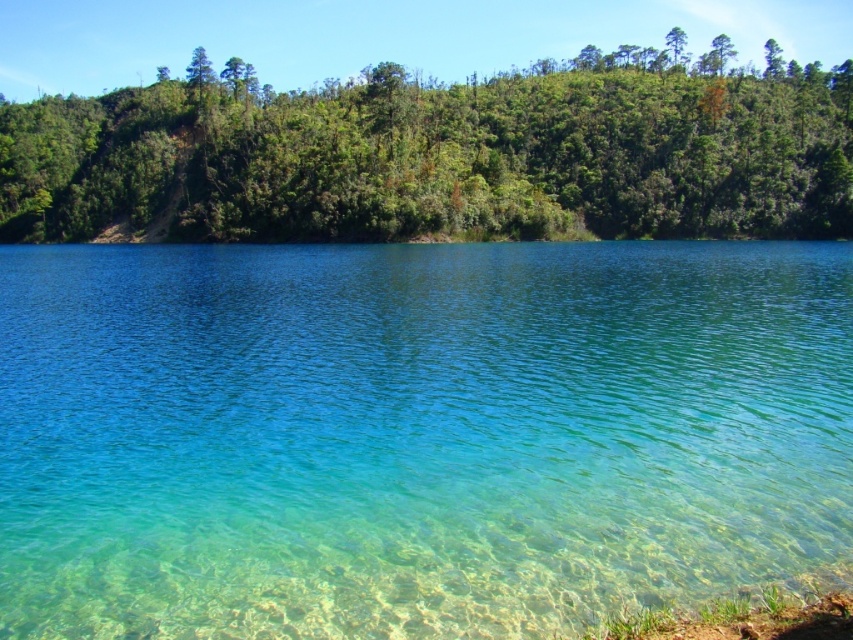
Who is shorter, green leafy trees at upper left or green leafy tree at upper center?

green leafy trees at upper left

Between point (527, 168) and point (677, 44), which one is positioned in front?

Point (527, 168) is more forward.

Where is `green leafy trees at upper left`? This screenshot has width=853, height=640. green leafy trees at upper left is located at coordinates (442, 156).

Find the location of a particular element. green leafy trees at upper left is located at coordinates (442, 156).

Can you confirm if clear water at center is bigger than green leafy tree at upper center?

Incorrect, clear water at center is not larger than green leafy tree at upper center.

Which is below, clear water at center or green leafy tree at upper center?

clear water at center is below.

Which is in front, point (460, 572) or point (668, 38)?

Positioned in front is point (460, 572).

I want to click on clear water at center, so click(415, 433).

Can you confirm if clear water at center is positioned to the left of green leafy trees at upper left?

No, clear water at center is not to the left of green leafy trees at upper left.

The height and width of the screenshot is (640, 853). I want to click on clear water at center, so click(x=415, y=433).

At what (x,y) coordinates should I click in order to perform the action: click on clear water at center. Please return your answer as a coordinate pair (x, y). Looking at the image, I should click on (415, 433).